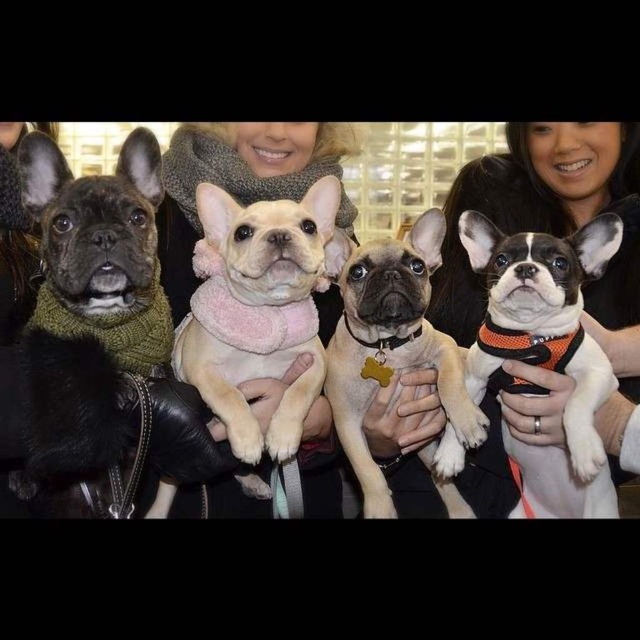
Which dog is positioned at the coordinates point (257, 310)?

The peachy fleece dog at center is located at point (257, 310).